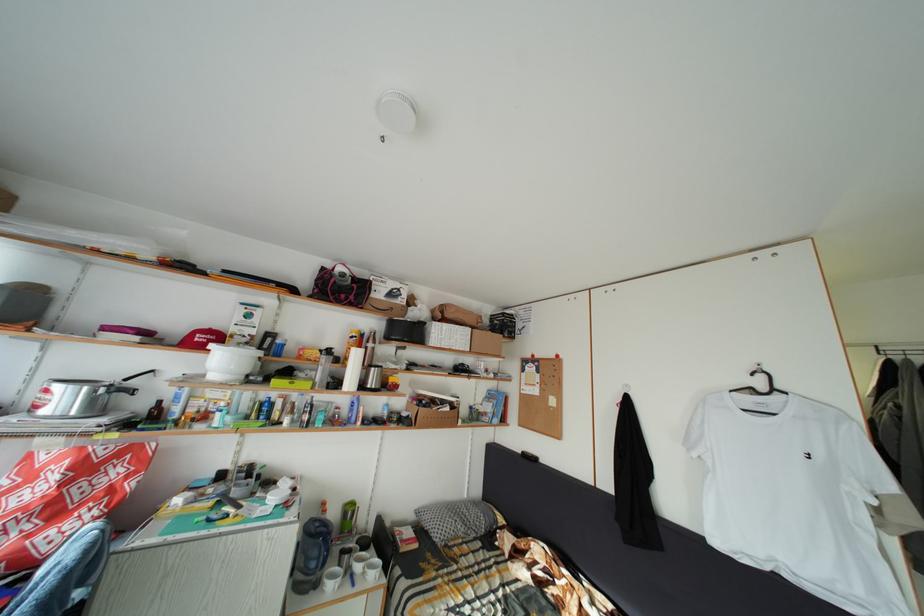
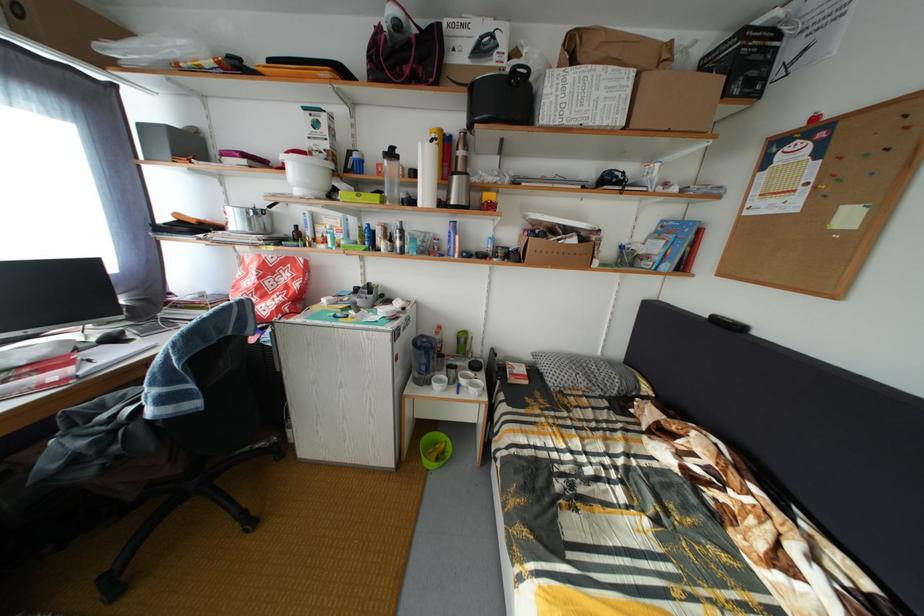
Find the pixel in the second image that matches point (382, 375) in the first image.

(464, 184)